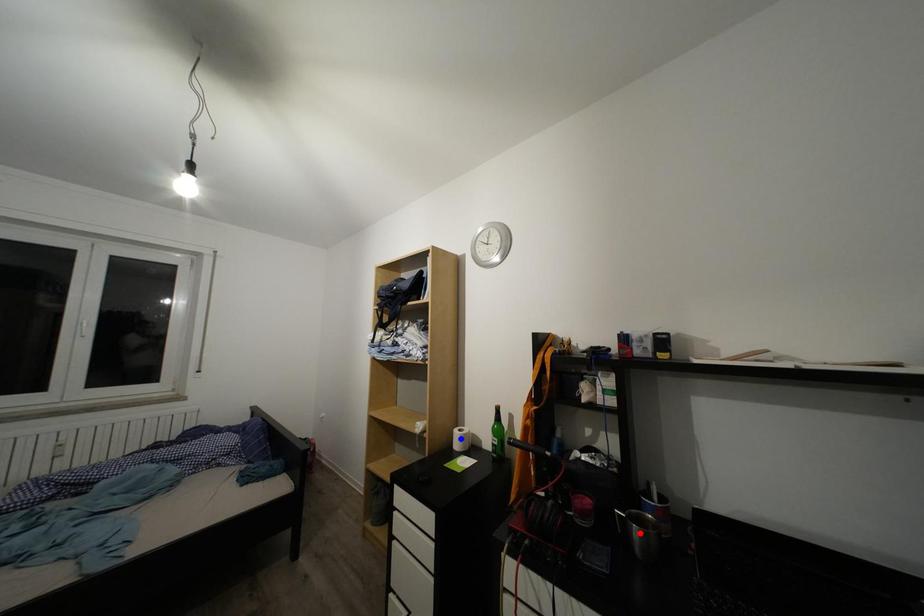
Question: Two points are marked on the image. Which point is closer to the camera?

Choices:
 (A) Blue point is closer.
 (B) Red point is closer.

Answer: (B)